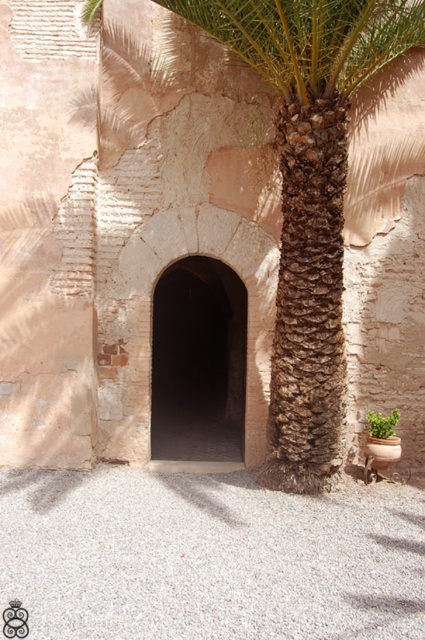
Question: Which object is positioned farthest from the green leafy plant at lower right?

Choices:
 (A) dark stone arch at center
 (B) brown textured palm tree at center

Answer: (A)

Question: Does dark stone arch at center lie behind green leafy plant at lower right?

Choices:
 (A) no
 (B) yes

Answer: (B)

Question: Can you confirm if dark stone arch at center is thinner than green leafy plant at lower right?

Choices:
 (A) yes
 (B) no

Answer: (B)

Question: Can you confirm if brown textured palm tree at center is positioned to the left of green leafy plant at lower right?

Choices:
 (A) yes
 (B) no

Answer: (A)

Question: Which object is closer to the camera taking this photo?

Choices:
 (A) brown textured palm tree at center
 (B) green leafy plant at lower right

Answer: (A)

Question: Which point appears farthest from the camera in this image?

Choices:
 (A) (379, 419)
 (B) (99, 342)
 (C) (163, 420)

Answer: (C)